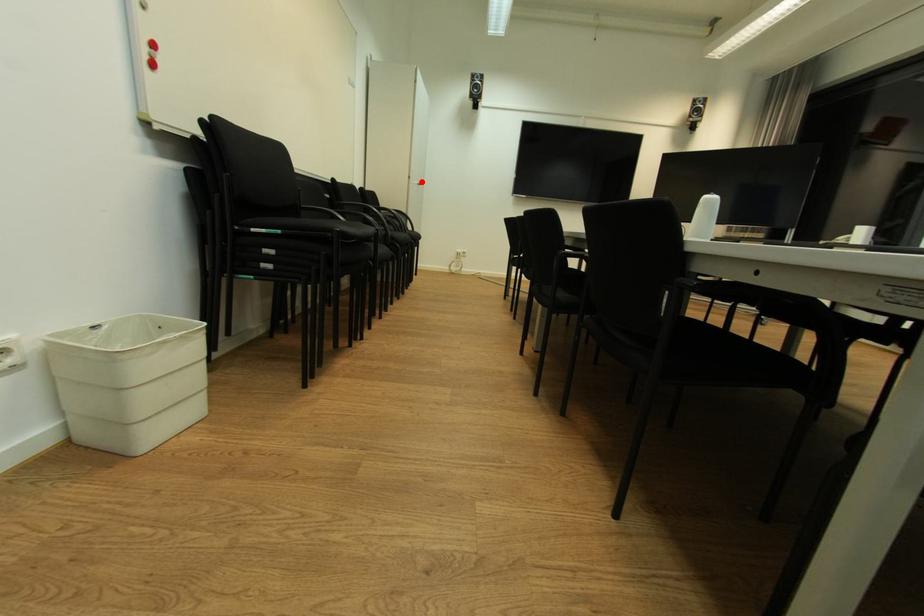
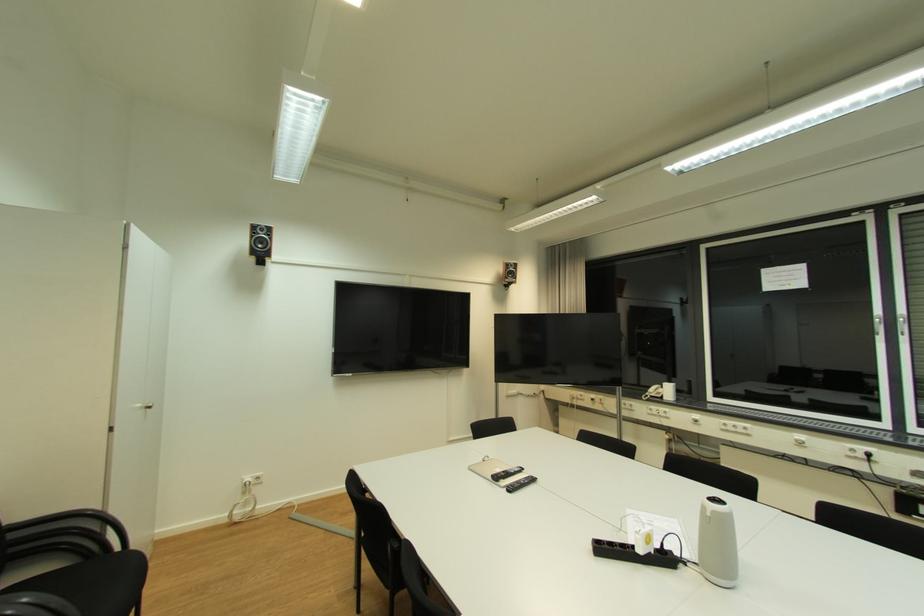
Question: I am providing you with two images of the same scene from different viewpoints. In image1, a red point is highlighted. Considering the same 3D point in image2, which of the following is correct?

Choices:
 (A) It is closer
 (B) It is farther

Answer: (B)